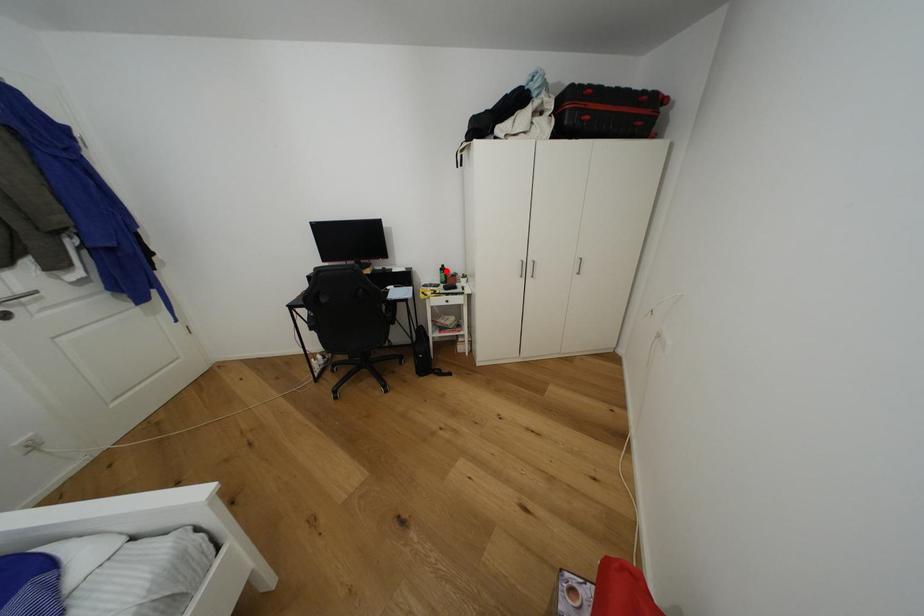
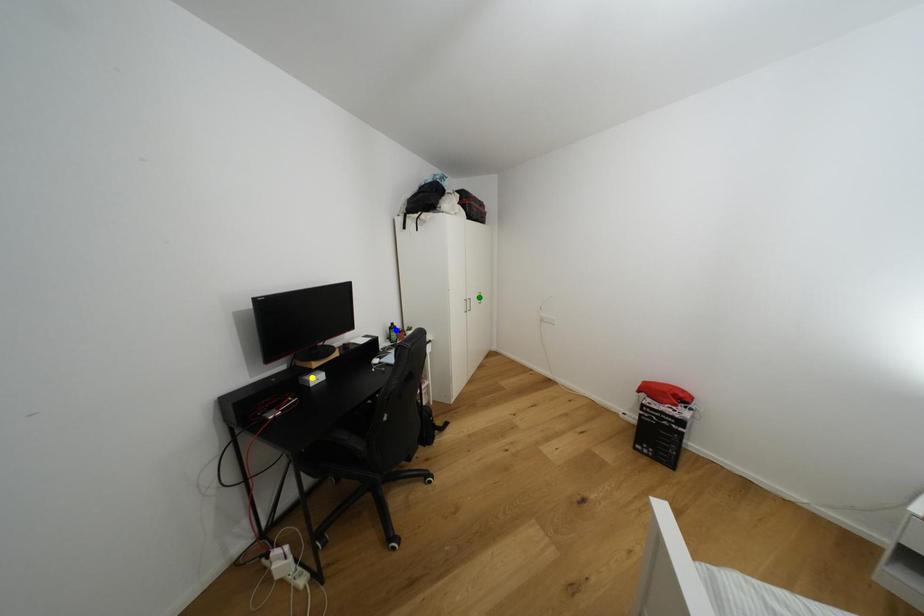
Question: I am providing you with two images of the same scene from different viewpoints. A red point is marked on the first image. You are given multiple points on the second image. In image 2, which mark is for the same physical point as the one in image 1?

Choices:
 (A) green point
 (B) yellow point
 (C) blue point

Answer: (C)